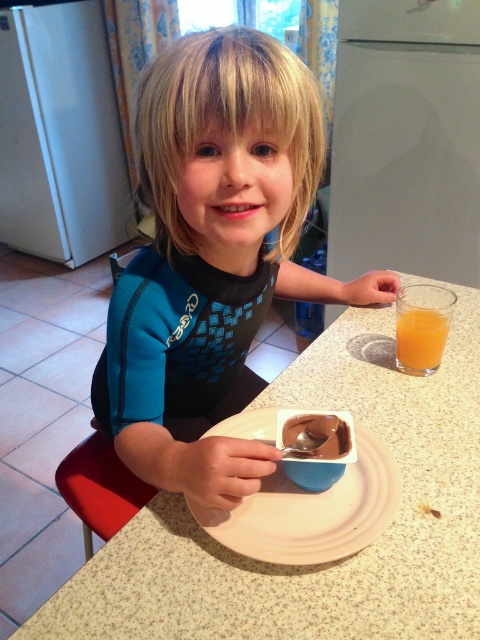
You are a parent trying to place a new decorative item on the kitchen counter. You see the white speckled table at center and the white matte plate at center. Which object should you place the item on top of to ensure it stays elevated?

→ The white speckled table at center is positioned over white matte plate at center, so placing the item on the white speckled table at center will keep it elevated above the plate.

You are a photographer setting up a shot of the child and their snack. The blue matte shirt at center and the translucent glass cup at right are in the frame. Which object should you focus on first if you want to ensure both are in focus?

The blue matte shirt at center is taller than the translucent glass cup at right, so focusing on the blue matte shirt at center first will help ensure both are in focus since it is the larger object in the frame.

You are a parent preparing to pack the child a lunchbox. You have a small container that can only hold items smaller than the metallic spoon at plate center. Can the translucent glass cup at right fit into the container?

The translucent glass cup at right has a larger size compared to the metallic spoon at plate center. Since the container can only hold items smaller than the metallic spoon, the translucent glass cup at right will not fit into the container.